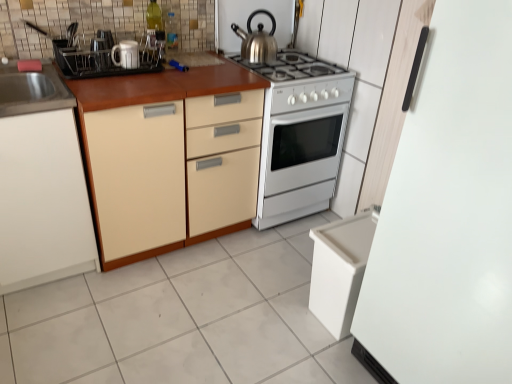
Question: Is white glossy mug at upper left, which is the 3th appliance in front-to-back order, bigger than white plastic dishwasher at lower right?

Choices:
 (A) yes
 (B) no

Answer: (B)

Question: Could you tell me if white glossy mug at upper left, marked as the 2th appliance in a back-to-front arrangement, is facing white plastic dishwasher at lower right?

Choices:
 (A) yes
 (B) no

Answer: (B)

Question: Considering the relative sizes of white glossy mug at upper left, which is the 3th appliance from right to left, and white plastic dishwasher at lower right in the image provided, is white glossy mug at upper left, which is the 3th appliance from right to left, thinner than white plastic dishwasher at lower right?

Choices:
 (A) no
 (B) yes

Answer: (B)

Question: Are white glossy mug at upper left, marked as the 2th appliance in a back-to-front arrangement, and white plastic dishwasher at lower right located far from each other?

Choices:
 (A) no
 (B) yes

Answer: (B)

Question: From a real-world perspective, is white glossy mug at upper left, which is the 3th appliance in front-to-back order, under white plastic dishwasher at lower right?

Choices:
 (A) yes
 (B) no

Answer: (B)

Question: Relative to white glossy gas stove at center, is white glossy tile at lower center in front or behind?

Choices:
 (A) front
 (B) behind

Answer: (A)

Question: Does point (298, 276) appear closer or farther from the camera than point (302, 84)?

Choices:
 (A) farther
 (B) closer

Answer: (A)

Question: Would you say white glossy tile at lower center is inside or outside white glossy gas stove at center?

Choices:
 (A) inside
 (B) outside

Answer: (B)

Question: From a real-world perspective, is white glossy tile at lower center positioned above or below white glossy gas stove at center?

Choices:
 (A) above
 (B) below

Answer: (B)

Question: In terms of width, does white glossy oven at center, placed as the third appliance when sorted from left to right, look wider or thinner when compared to white plastic dishwasher at lower right?

Choices:
 (A) thin
 (B) wide

Answer: (B)

Question: Is white glossy oven at center, placed as the third appliance when sorted from left to right, taller or shorter than white plastic dishwasher at lower right?

Choices:
 (A) tall
 (B) short

Answer: (A)

Question: Is point (279, 124) closer or farther from the camera than point (344, 306)?

Choices:
 (A) farther
 (B) closer

Answer: (A)

Question: Visually, is white glossy oven at center, marked as the second appliance in a right-to-left arrangement, positioned to the left or to the right of white plastic dishwasher at lower right?

Choices:
 (A) left
 (B) right

Answer: (A)

Question: From the image's perspective, relative to white glossy mug at upper left, the 2th appliance viewed from the left, is white plastic dishwasher at lower right above or below?

Choices:
 (A) below
 (B) above

Answer: (A)

Question: From a real-world perspective, is white plastic dishwasher at lower right above or below white glossy mug at upper left, which is the 3th appliance in front-to-back order?

Choices:
 (A) below
 (B) above

Answer: (A)